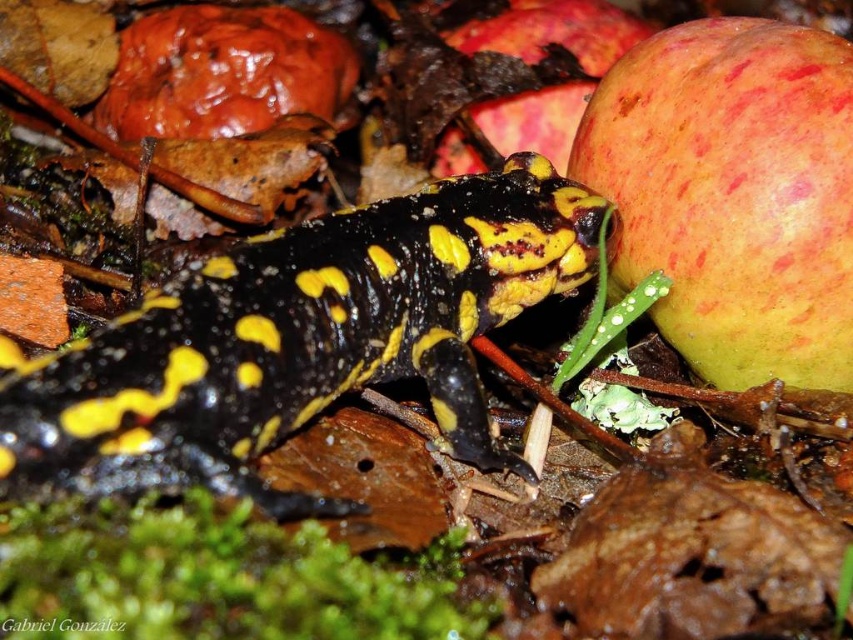
Question: Is speckled red apple at right thinner than ripe red apple at upper right?

Choices:
 (A) no
 (B) yes

Answer: (B)

Question: Where is speckled red apple at right located in relation to ripe red apple at upper right in the image?

Choices:
 (A) right
 (B) left

Answer: (A)

Question: Is speckled red apple at right positioned at the back of ripe red apple at upper right?

Choices:
 (A) yes
 (B) no

Answer: (B)

Question: Which object is farther from the camera taking this photo?

Choices:
 (A) ripe red apple at upper right
 (B) speckled red apple at right

Answer: (A)

Question: Among these objects, which one is farthest from the camera?

Choices:
 (A) ripe red apple at upper right
 (B) speckled red apple at right

Answer: (A)

Question: Which point is farther to the camera?

Choices:
 (A) speckled red apple at right
 (B) ripe red apple at upper right

Answer: (B)